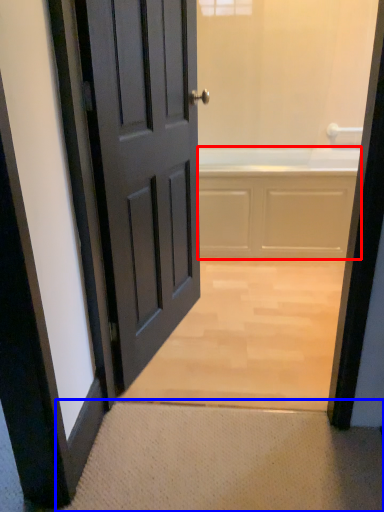
Question: Among these objects, which one is nearest to the camera, bath (highlighted by a red box) or doormat (highlighted by a blue box)?

Choices:
 (A) bath
 (B) doormat

Answer: (B)